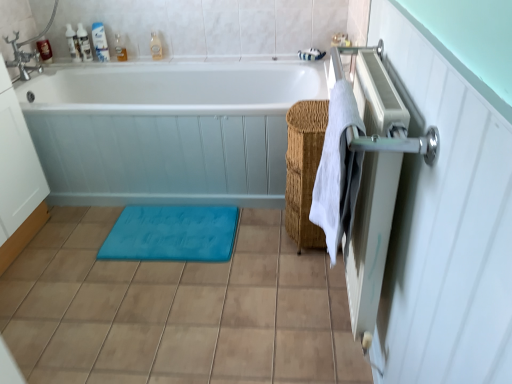
Find the location of `blank area beneath white cotton towel at right (from a real-world perspective)`. blank area beneath white cotton towel at right (from a real-world perspective) is located at coordinates (314, 335).